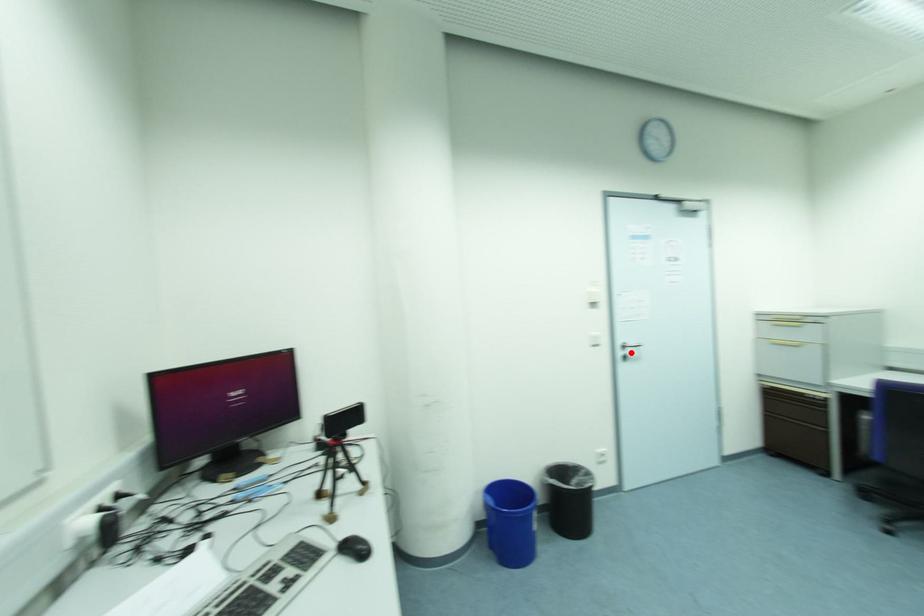
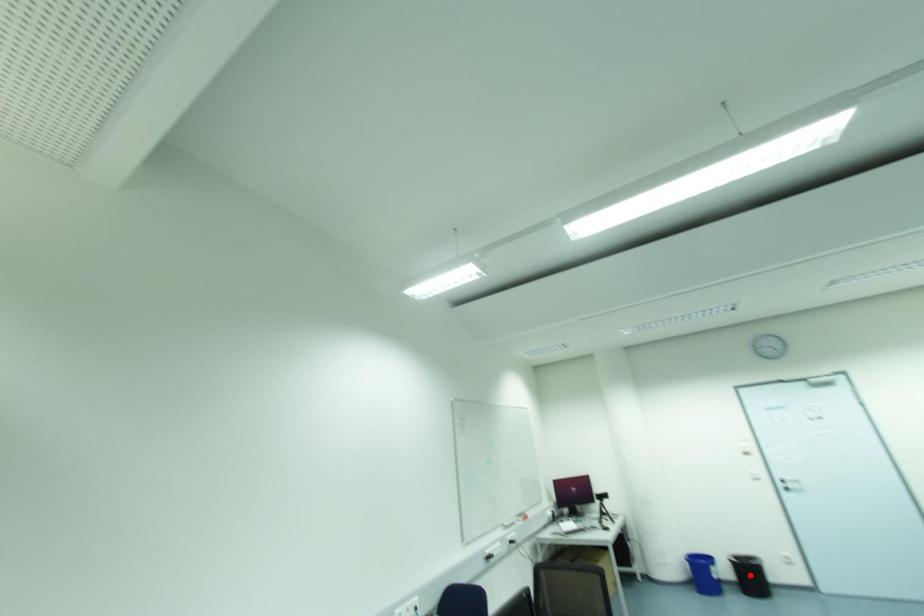
Looking at this image, I am providing you with two images of the same scene from different viewpoints. A red point is marked on the first image and another point is marked on the second image. Are the points marked in image1 and image2 representing the same 3D position?

No